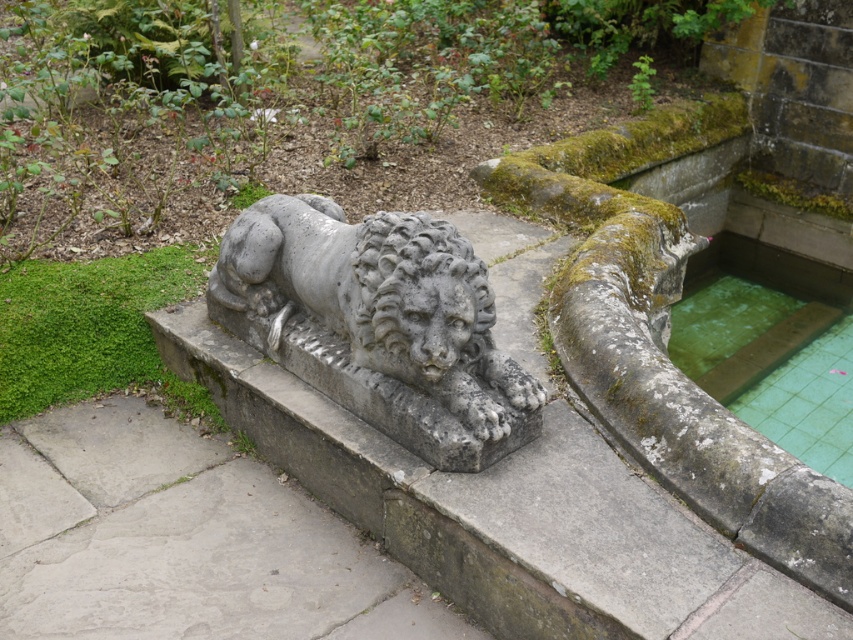
You are an architect designing a new garden layout. You need to place a new statue that is 1.5 meters wide. The gray stone lion at center and the green tiled water at right are already in the garden. Considering their sizes, can the new statue fit between them without overlapping?

The gray stone lion at center is smaller than the green tiled water at right. Since the new statue is 1.5 meters wide, it depends on the actual sizes of the existing objects. However, the description only states the relative size between them, not their absolute dimensions. Without specific measurements, it is impossible to determine if there is enough space between them for the new statue.

You are standing in front of the stone lion statue and want to place a small flower pot on the ground near the green tiled water at right. Is the gray stone lion at center blocking your path to the water?

The gray stone lion at center is above the green tiled water at right, so it is elevated and not directly blocking the path to the water. You can place the flower pot near the water without obstruction from the lion.